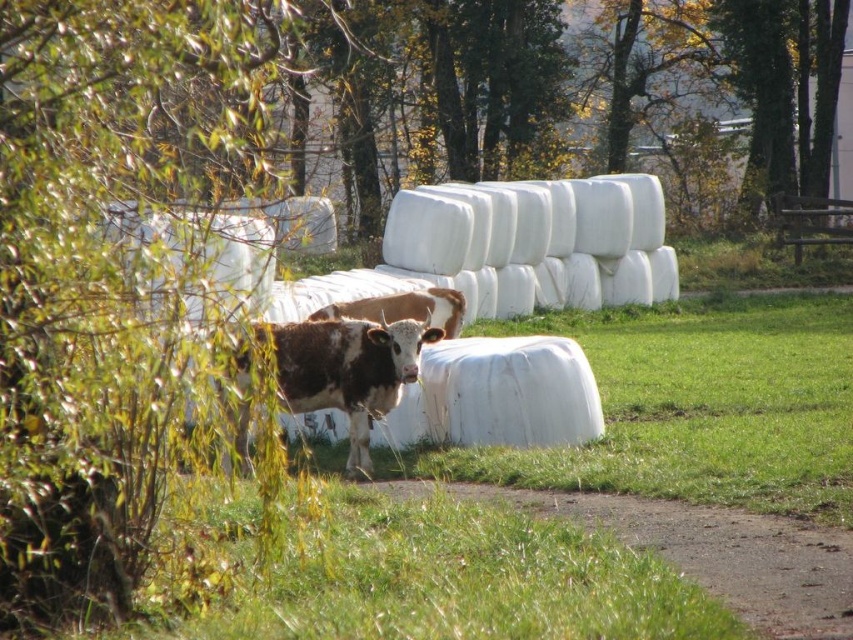
Question: Does brown speckled hide at center have a greater width compared to brown speckled cow at center?

Choices:
 (A) yes
 (B) no

Answer: (B)

Question: Does brown speckled hide at center appear on the left side of brown speckled cow at center?

Choices:
 (A) yes
 (B) no

Answer: (B)

Question: Which of the following is the closest to the observer?

Choices:
 (A) (297, 332)
 (B) (460, 307)

Answer: (A)

Question: Can you confirm if brown speckled hide at center is thinner than brown speckled cow at center?

Choices:
 (A) no
 (B) yes

Answer: (B)